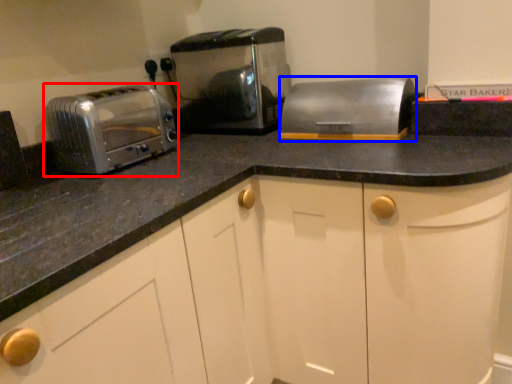
Question: Which object appears closest to the camera in this image, toaster (highlighted by a red box) or appliance (highlighted by a blue box)?

Choices:
 (A) toaster
 (B) appliance

Answer: (A)